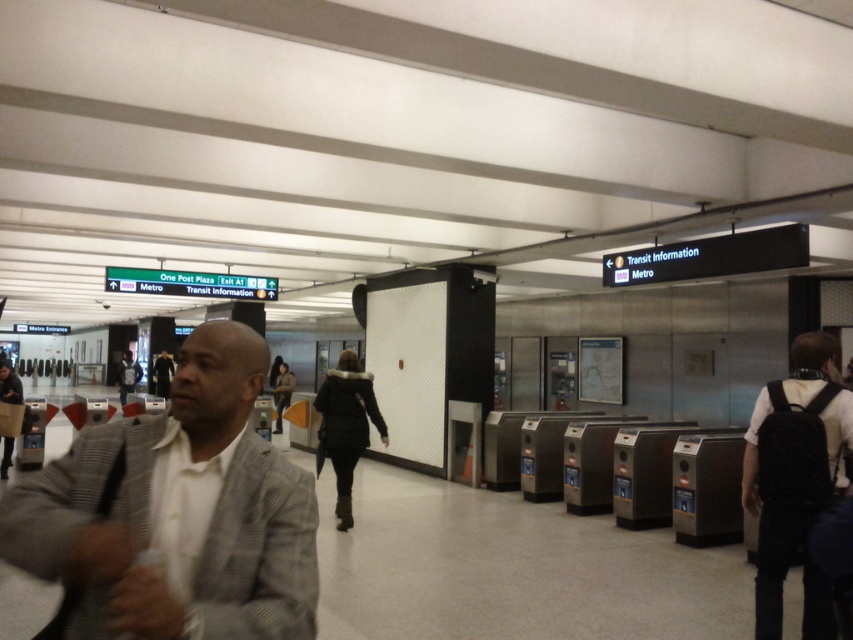
Is gray textured blazer at center positioned in front of black backpack at right?

Yes, it is in front of black backpack at right.

Between gray textured blazer at center and black backpack at right, which one is positioned higher?

gray textured blazer at center

Between point (251, 602) and point (828, 355), which one is positioned behind?

Point (828, 355)

At what (x,y) coordinates should I click in order to perform the action: click on gray textured blazer at center. Please return your answer as a coordinate pair (x, y). The height and width of the screenshot is (640, 853). Looking at the image, I should click on (178, 513).